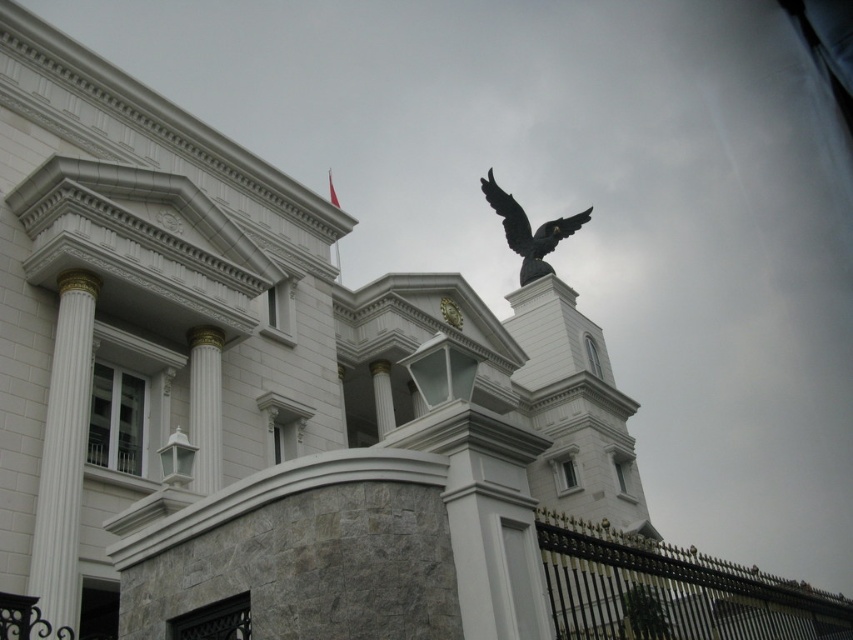
Based on the scene description, where is the white marble column at left located in the image?

The white marble column at left is located at point (64, 452) in the image.

You are an architect analyzing the symmetry of the building. Given the placement of the white marble column at center and the shiny black eagle at upper center, which object is located to the left of the other?

The white marble column at center is positioned on the left side of shiny black eagle at upper center, so the column is to the left of the eagle.

From the picture: Based on the scene description, can you determine which object is wider between the white marble column at center and the shiny black eagle at upper center?

The white marble column at center is thinner than the shiny black eagle at upper center, so the shiny black eagle at upper center is wider.